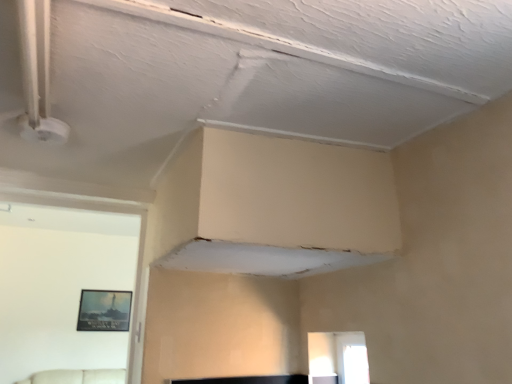
The image size is (512, 384). What do you see at coordinates (104, 310) in the screenshot? I see `matte black picture frame at left` at bounding box center [104, 310].

You are a GUI agent. You are given a task and a screenshot of the screen. Output one action in this format:
    pyautogui.click(x=<x>, y=<y>)
    Task: Click on the matte black picture frame at left
    
    Given the screenshot: What is the action you would take?
    pyautogui.click(x=104, y=310)

Measure the distance between matte black picture frame at left and camera.

The distance of matte black picture frame at left from camera is 5.46 meters.

Describe the element at coordinates (337, 358) in the screenshot. The height and width of the screenshot is (384, 512). I see `transparent glass window at lower right` at that location.

Measure the distance between transparent glass window at lower right and camera.

The distance of transparent glass window at lower right from camera is 6.29 feet.

You are a GUI agent. You are given a task and a screenshot of the screen. Output one action in this format:
    pyautogui.click(x=<x>, y=<y>)
    Task: Click on the transparent glass window at lower right
    The height and width of the screenshot is (384, 512).
    Given the screenshot: What is the action you would take?
    pyautogui.click(x=337, y=358)

In order to click on matte black picture frame at left in this screenshot , I will do `click(104, 310)`.

Which is more to the right, transparent glass window at lower right or matte black picture frame at left?

transparent glass window at lower right is more to the right.

Is transparent glass window at lower right positioned before matte black picture frame at left?

Yes, it is.

Which point is more forward, [314,340] or [116,296]?

Positioned in front is point [314,340].

From the image's perspective, is transparent glass window at lower right located above matte black picture frame at left?

Yes, from the image's perspective, transparent glass window at lower right is over matte black picture frame at left.

From a real-world perspective, which object rests below the other?

transparent glass window at lower right.

Considering the sizes of transparent glass window at lower right and matte black picture frame at left in the image, is transparent glass window at lower right wider or thinner than matte black picture frame at left?

transparent glass window at lower right is wider than matte black picture frame at left.

From their relative heights in the image, would you say transparent glass window at lower right is taller or shorter than matte black picture frame at left?

Clearly, transparent glass window at lower right is shorter compared to matte black picture frame at left.

Between transparent glass window at lower right and matte black picture frame at left, which one has larger size?

With larger size is transparent glass window at lower right.

Would you say transparent glass window at lower right is outside matte black picture frame at left?

Yes.

Would you say transparent glass window at lower right is a long distance from matte black picture frame at left?

transparent glass window at lower right is far away from matte black picture frame at left.

Is transparent glass window at lower right oriented away from matte black picture frame at left?

No, transparent glass window at lower right is not facing the opposite direction of matte black picture frame at left.

How different are the orientations of transparent glass window at lower right and matte black picture frame at left in degrees?

89.2 degrees.

How distant is transparent glass window at lower right from matte black picture frame at left?

transparent glass window at lower right and matte black picture frame at left are 4.20 meters apart.

I want to click on window that is in front of the matte black picture frame at left, so click(337, 358).

Can you confirm if matte black picture frame at left is positioned to the right of transparent glass window at lower right?

No, matte black picture frame at left is not to the right of transparent glass window at lower right.

Consider the image. Which object is further away from the camera, matte black picture frame at left or transparent glass window at lower right?

matte black picture frame at left is more distant.

Is point (114, 330) more distant than point (359, 375)?

Yes, it is behind point (359, 375).

From the image's perspective, which object appears higher, matte black picture frame at left or transparent glass window at lower right?

transparent glass window at lower right is shown above in the image.

From a real-world perspective, which object stands above the other?

matte black picture frame at left is physically above.

Can you confirm if matte black picture frame at left is wider than transparent glass window at lower right?

In fact, matte black picture frame at left might be narrower than transparent glass window at lower right.

Is matte black picture frame at left taller than transparent glass window at lower right?

Correct, matte black picture frame at left is much taller as transparent glass window at lower right.

Does matte black picture frame at left have a larger size compared to transparent glass window at lower right?

No, matte black picture frame at left is not bigger than transparent glass window at lower right.

Is matte black picture frame at left outside of transparent glass window at lower right?

Yes, matte black picture frame at left is outside of transparent glass window at lower right.

Is matte black picture frame at left placed right next to transparent glass window at lower right?

matte black picture frame at left and transparent glass window at lower right are not in contact.

Could you tell me if matte black picture frame at left is facing transparent glass window at lower right?

Yes, matte black picture frame at left is oriented towards transparent glass window at lower right.

I want to click on window below the matte black picture frame at left (from a real-world perspective), so click(337, 358).

You are a GUI agent. You are given a task and a screenshot of the screen. Output one action in this format:
    pyautogui.click(x=<x>, y=<y>)
    Task: Click on the window located in front of the matte black picture frame at left
    This screenshot has height=384, width=512.
    Given the screenshot: What is the action you would take?
    pyautogui.click(x=337, y=358)

Image resolution: width=512 pixels, height=384 pixels. Find the location of `picture frame on the left of the transparent glass window at lower right`. picture frame on the left of the transparent glass window at lower right is located at coordinates (104, 310).